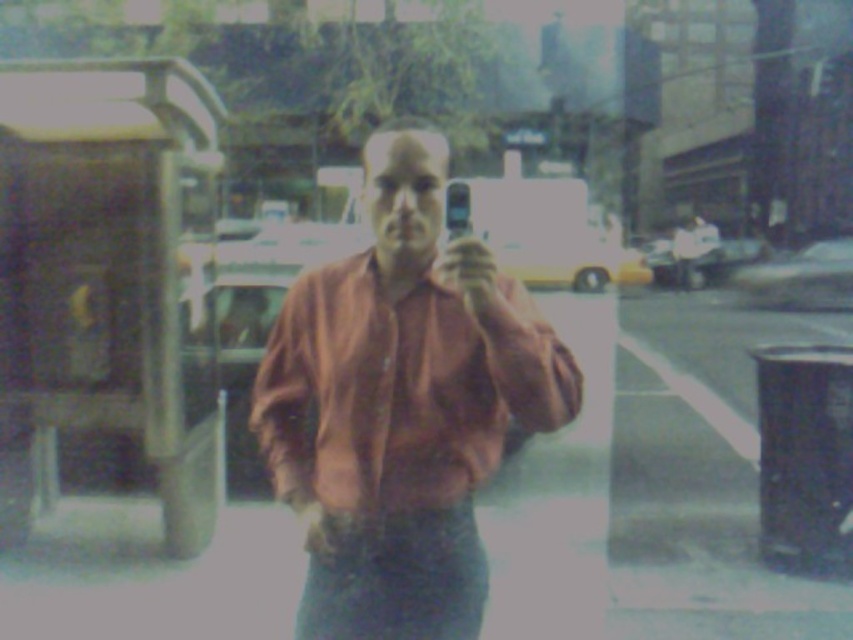
Is the position of matte pink shirt at center more distant than that of denim at lower center?

No, matte pink shirt at center is in front of denim at lower center.

Locate an element on the screen. matte pink shirt at center is located at coordinates (402, 404).

Which is behind, point (299, 376) or point (451, 547)?

The point (299, 376) is behind.

What are the coordinates of `matte pink shirt at center` in the screenshot? It's located at (402, 404).